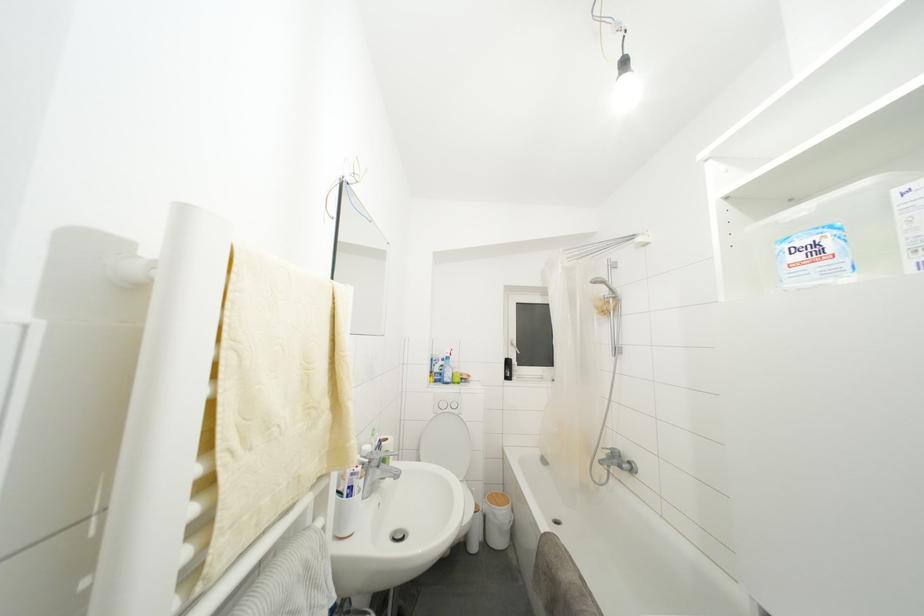
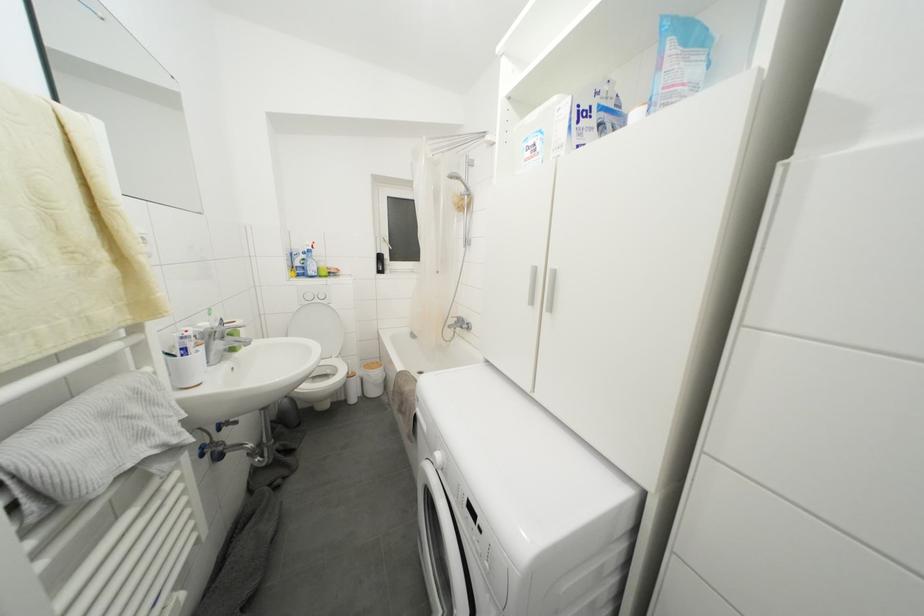
Locate, in the second image, the point that corresponds to (x=445, y=371) in the first image.

(308, 264)